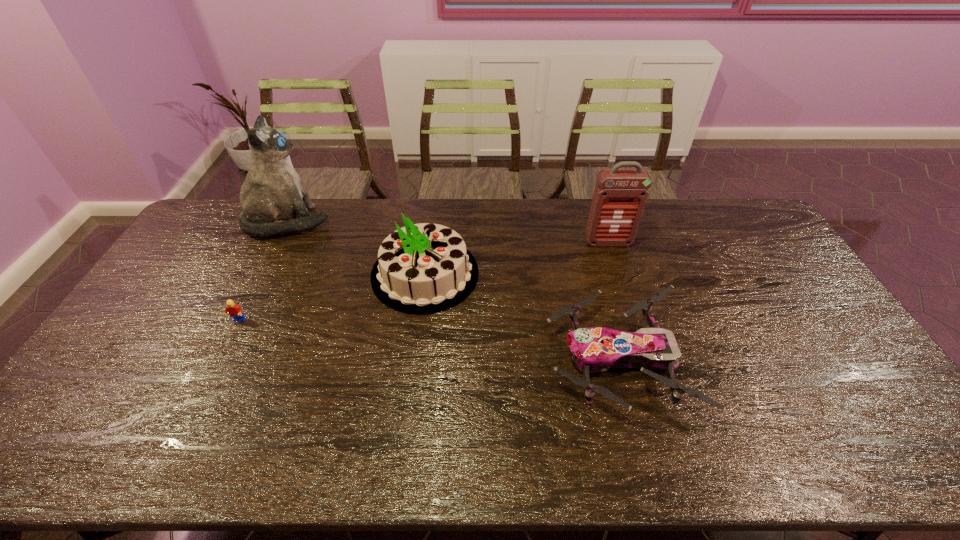
At what (x,y) coordinates should I click in order to perform the action: click on vacant space located 0.160m on the front-facing side of the drone. Please return your answer as a coordinate pair (x, y). Looking at the image, I should click on (489, 360).

The image size is (960, 540). In order to click on vacant region located 0.120m on the front-facing side of the drone in this screenshot , I will do `click(503, 360)`.

The width and height of the screenshot is (960, 540). In order to click on free space located 0.220m on the front-facing side of the Lego in this screenshot , I will do `click(203, 391)`.

The width and height of the screenshot is (960, 540). I want to click on cat that is at the far edge, so click(x=273, y=194).

Where is `the first-aid kit present at the far edge`? The image size is (960, 540). the first-aid kit present at the far edge is located at coordinates (620, 195).

You are a GUI agent. You are given a task and a screenshot of the screen. Output one action in this format:
    pyautogui.click(x=<x>, y=<y>)
    Task: Click on the object present at the left edge
    The width and height of the screenshot is (960, 540).
    Given the screenshot: What is the action you would take?
    pyautogui.click(x=273, y=194)

You are a GUI agent. You are given a task and a screenshot of the screen. Output one action in this format:
    pyautogui.click(x=<x>, y=<y>)
    Task: Click on the object at the far left corner
    Image resolution: width=960 pixels, height=540 pixels.
    Given the screenshot: What is the action you would take?
    pyautogui.click(x=273, y=194)

Identify the location of vacant area at the far edge. (530, 232).

The image size is (960, 540). In the image, there is a desktop. Identify the location of vacant area at the near edge. (585, 455).

Locate an element on the screen. vacant area at the left edge of the desktop is located at coordinates (95, 426).